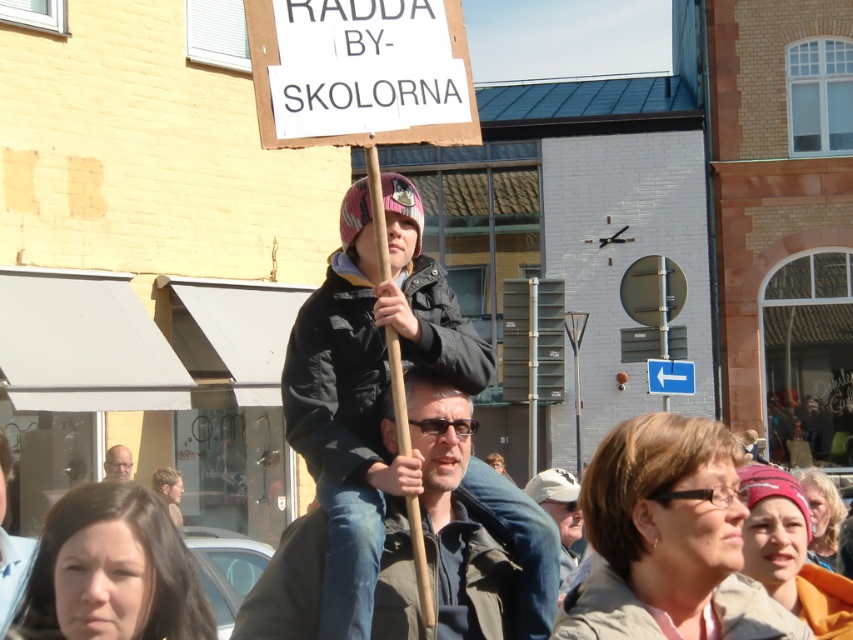
You are standing at point (517, 621). You need to reach a specific location that is 16.92 meters away. Which direction should you move to reach it?

The specific location is 16.92 meters away from point (517, 621), but without additional information about the layout or landmarks, it is impossible to determine the exact direction to move.

You are a photographer standing in the middle of the street. You notice the light brown leather jacket at lower left and the matte black glasses at lower left. Which object is positioned closer to you?

The light brown leather jacket at lower left is closer to the viewer than the matte black glasses at lower left.

You are a photographer trying to capture a photo of the dark green jacket at center and the light brown leather jacket at lower left. Based on their positions, which jacket should you focus on first to ensure both are in the frame?

The dark green jacket at center is located above the light brown leather jacket at lower left, so you should focus on the dark green jacket at center first to ensure both are in the frame.